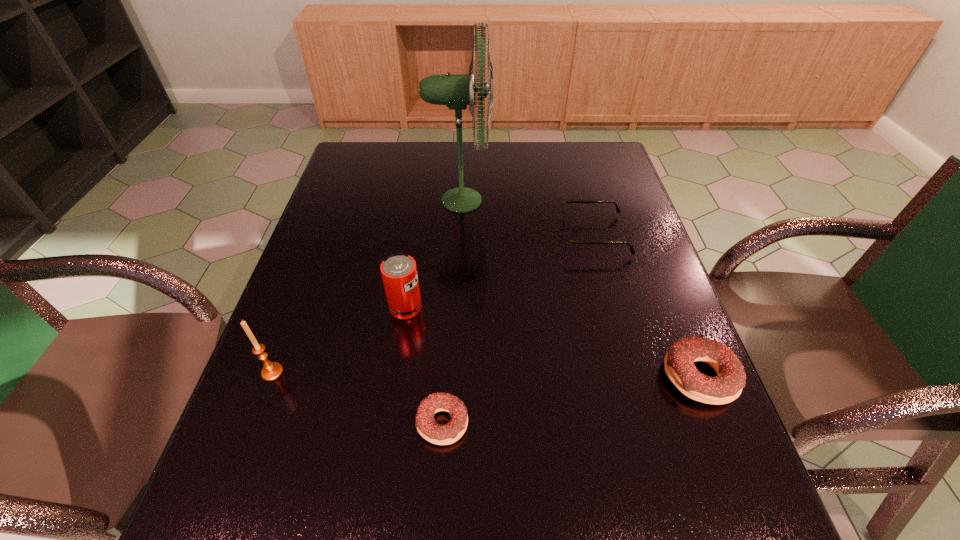
You are a GUI agent. You are given a task and a screenshot of the screen. Output one action in this format:
    pyautogui.click(x=<x>, y=<y>)
    Task: Click on the shortest object
    
    Given the screenshot: What is the action you would take?
    pyautogui.click(x=431, y=431)

You are a GUI agent. You are given a task and a screenshot of the screen. Output one action in this format:
    pyautogui.click(x=<x>, y=<y>)
    Task: Click on the left doughnut
    The height and width of the screenshot is (540, 960).
    Given the screenshot: What is the action you would take?
    tap(431, 431)

Find the location of a particular element. The image size is (960, 540). the right doughnut is located at coordinates (724, 388).

Locate an element on the screen. fan is located at coordinates (456, 91).

Where is `spectacles`? This screenshot has height=540, width=960. spectacles is located at coordinates (569, 242).

Locate an element on the screen. The height and width of the screenshot is (540, 960). the leftmost object is located at coordinates (271, 370).

Where is `the fourth shortest object`? This screenshot has height=540, width=960. the fourth shortest object is located at coordinates (399, 274).

Where is `the third farthest object`? the third farthest object is located at coordinates (399, 274).

This screenshot has width=960, height=540. Find the location of `vacant region located on the right of the shortest object`. vacant region located on the right of the shortest object is located at coordinates (627, 422).

You are a GUI agent. You are given a task and a screenshot of the screen. Output one action in this format:
    pyautogui.click(x=<x>, y=<y>)
    Task: Click on the free location located 0.060m on the left of the taller doughnut
    
    Given the screenshot: What is the action you would take?
    pyautogui.click(x=634, y=376)